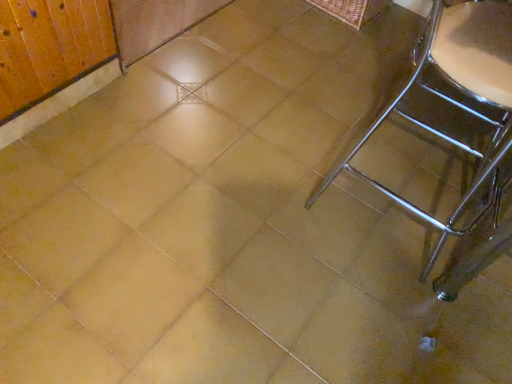
You are a GUI agent. You are given a task and a screenshot of the screen. Output one action in this format:
    pyautogui.click(x=<x>, y=<y>)
    Task: Click on the free region on the left part of polished chrome chair at right
    This screenshot has height=384, width=512.
    Given the screenshot: What is the action you would take?
    pyautogui.click(x=282, y=188)